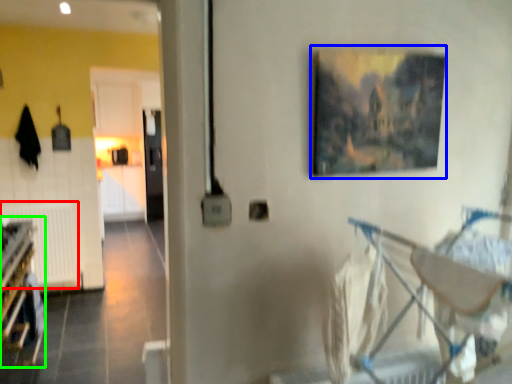
Question: Estimate the real-world distances between objects in this image. Which object is closer to radiator (highlighted by a red box), picture frame (highlighted by a blue box) or bunk bed (highlighted by a green box)?

Choices:
 (A) picture frame
 (B) bunk bed

Answer: (B)